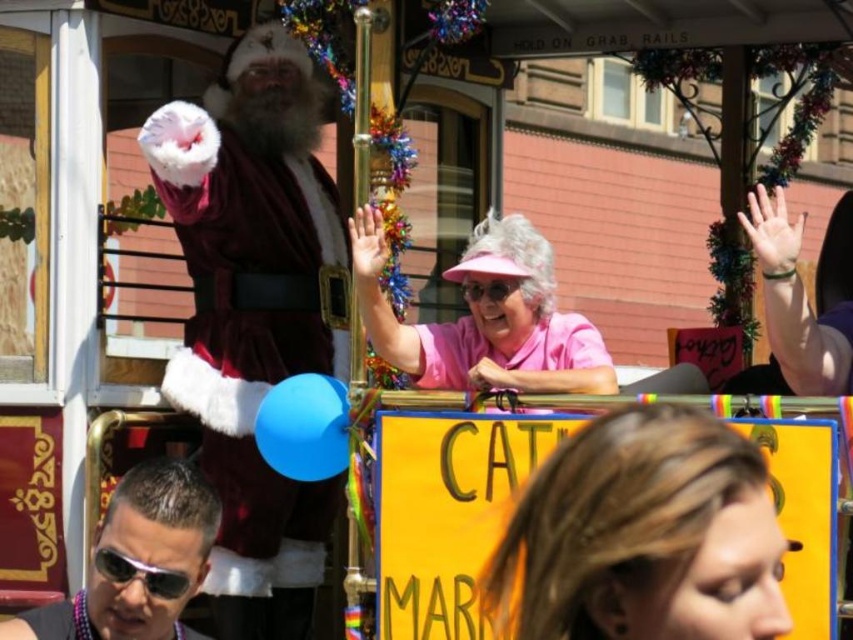
You are a photographer trying to capture a clear photo of both the velvet maroon santa at left and the shiny black sunglasses at center. However, the sunglasses are partially blocking the view of Santa. Is the sunglasses in front of or behind Santa?

The shiny black sunglasses at center is behind velvet maroon santa at left, so the sunglasses are not blocking Santa. You can take the photo without any obstruction.

You are a photographer at the parade. You need to capture a photo of the Santa Claus and the pink fabric hat at upper center. Where should you position yourself to ensure both are in the frame?

Position yourself so that Santa Claus and the pink fabric hat at upper center are within your camera viewfinder. Since the pink fabric hat at upper center is located at point (642, 536), you should aim your camera slightly upwards to include both subjects in the shot.

You are standing in the crowd watching the parade float. There are two points marked on the float. The first point is at coordinate (704, 538) and the second is at (350, 224). Which point is closer to you?

The point at coordinate (704, 538) is closer to you because it is closer to the camera than the point at (350, 224).